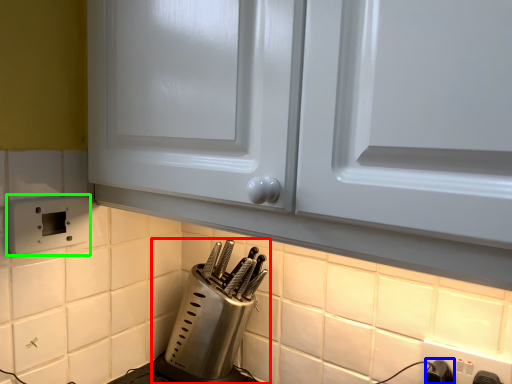
Question: Which is farther away from kitchen appliance (highlighted by a red box)? switch (highlighted by a blue box) or electric outlet (highlighted by a green box)?

Choices:
 (A) switch
 (B) electric outlet

Answer: (A)